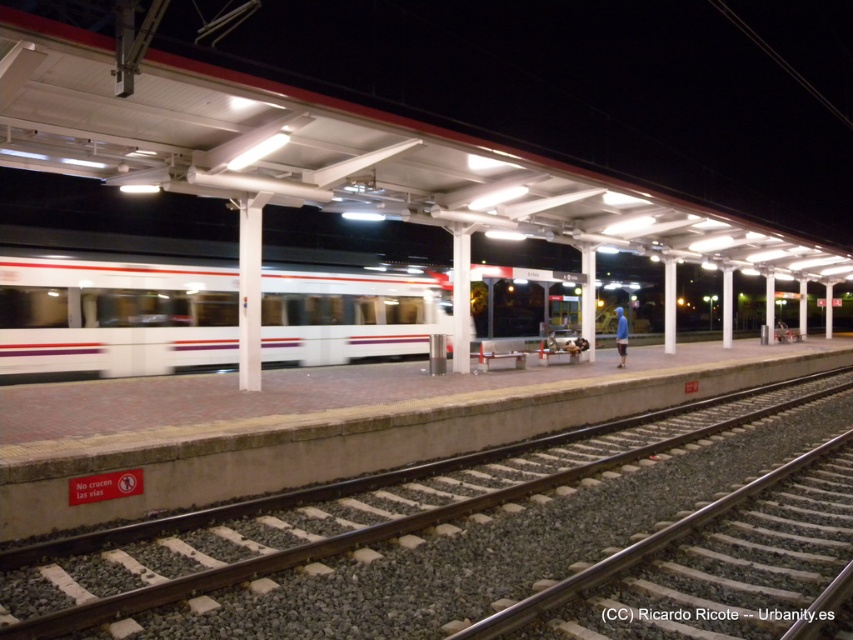
You are standing at the platform edge of the train station. There is a brown gravel track at lower center located at point (x=344, y=513). If you walk straight towards the direction of the train, will you step onto the brown gravel track at lower center before reaching the train?

Yes, because the brown gravel track at lower center is located at point (x=344, y=513), which is between your current position at the platform edge and the train, so you would step onto it before reaching the train.

You are standing on the train station platform and see the brown gravel track at lower center and the smooth steel tracks at center. Which of these two tracks is closer to the platform edge?

The brown gravel track at lower center is positioned on the right side of smooth steel tracks at center, so the smooth steel tracks at center are closer to the platform edge since the gravel track is to its right.

You are a maintenance worker on the platform and need to inspect both the brown gravel track at lower center and the smooth steel tracks at center. Which track is on top of the other?

The brown gravel track at lower center is positioned over the smooth steel tracks at center.